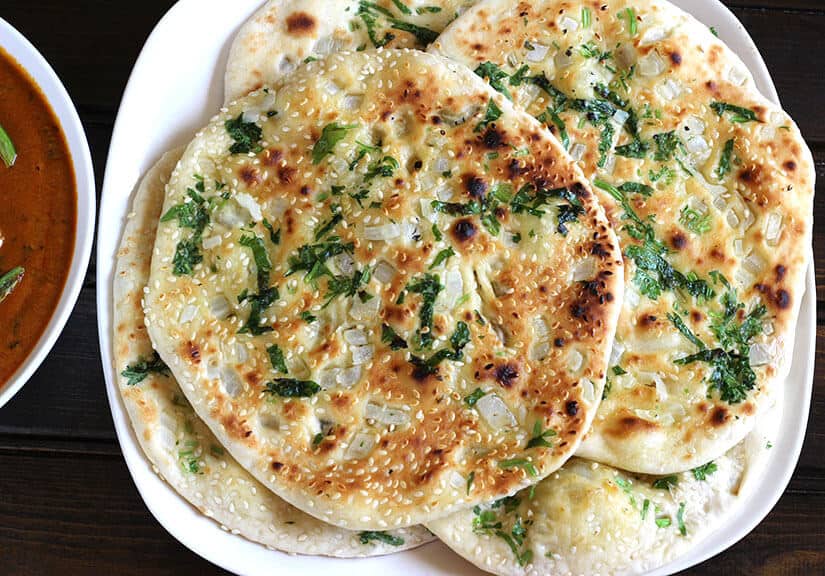
This screenshot has height=576, width=825. I want to click on plate, so click(158, 96).